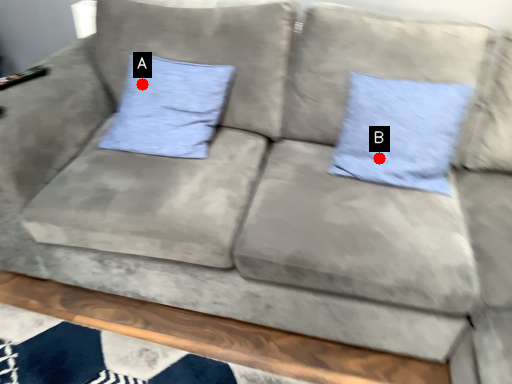
Question: Two points are circled on the image, labeled by A and B beside each circle. Which point appears closest to the camera in this image?

Choices:
 (A) A is closer
 (B) B is closer

Answer: (B)